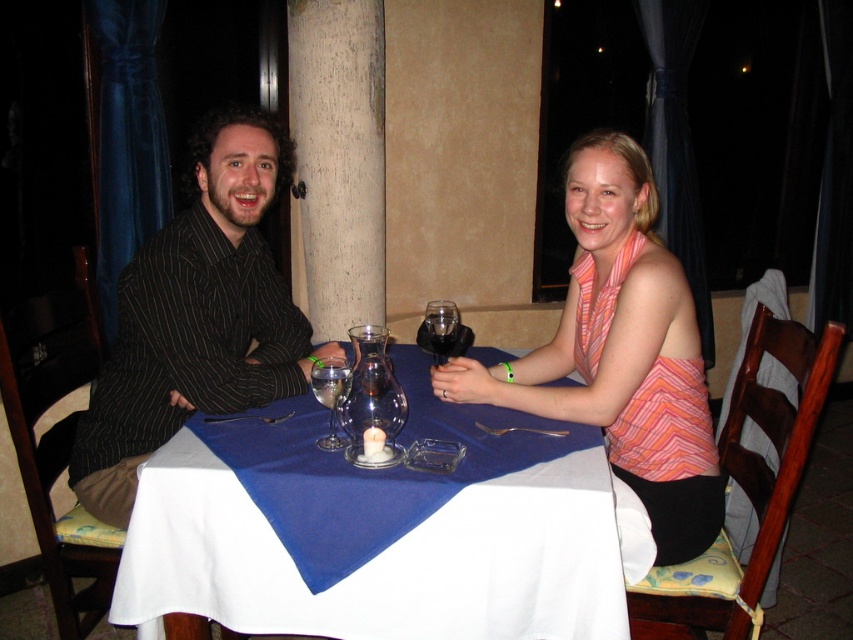
This screenshot has height=640, width=853. What do you see at coordinates (196, 316) in the screenshot?
I see `black striped shirt at left` at bounding box center [196, 316].

Is point (233, 180) closer to camera compared to point (648, 316)?

That is False.

You are a GUI agent. You are given a task and a screenshot of the screen. Output one action in this format:
    pyautogui.click(x=<x>, y=<y>)
    Task: Click on the black striped shirt at left
    The height and width of the screenshot is (640, 853).
    Given the screenshot: What is the action you would take?
    point(196,316)

Is black striped shirt at left to the left of translucent glass wine at center from the viewer's perspective?

Indeed, black striped shirt at left is positioned on the left side of translucent glass wine at center.

Consider the image. Who is more distant from viewer, (126, 291) or (451, 342)?

Positioned behind is point (451, 342).

What do you see at coordinates (196, 316) in the screenshot? I see `black striped shirt at left` at bounding box center [196, 316].

Identify the location of black striped shirt at left. (196, 316).

Between clear glass wine at center and translucent glass wine at center, which one has less height?

translucent glass wine at center

Does clear glass wine at center appear under translucent glass wine at center?

Yes, clear glass wine at center is below translucent glass wine at center.

Between point (325, 406) and point (440, 346), which one is positioned behind?

Positioned behind is point (440, 346).

Locate an element on the screen. The width and height of the screenshot is (853, 640). clear glass wine at center is located at coordinates (329, 385).